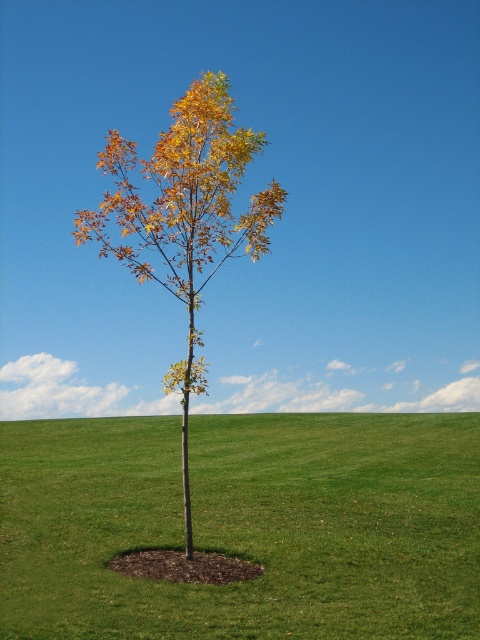
You are standing at the point marked as point (243, 525) in the image. Looking around, you see the solitary tree with a mix of green and autumnal orange leaves. What is directly under your feet?

The point (243, 525) is on green grass at center, so what is directly under your feet is green grass.